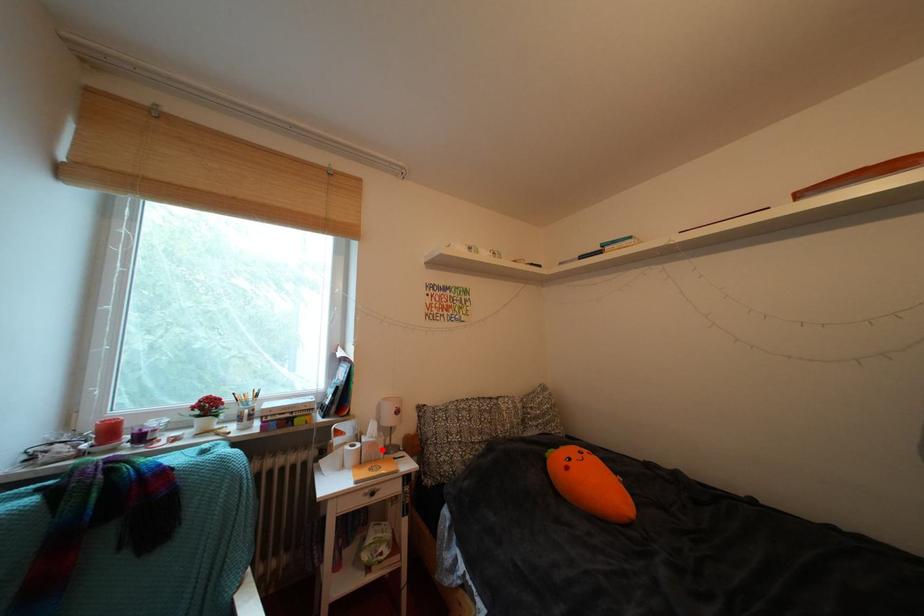
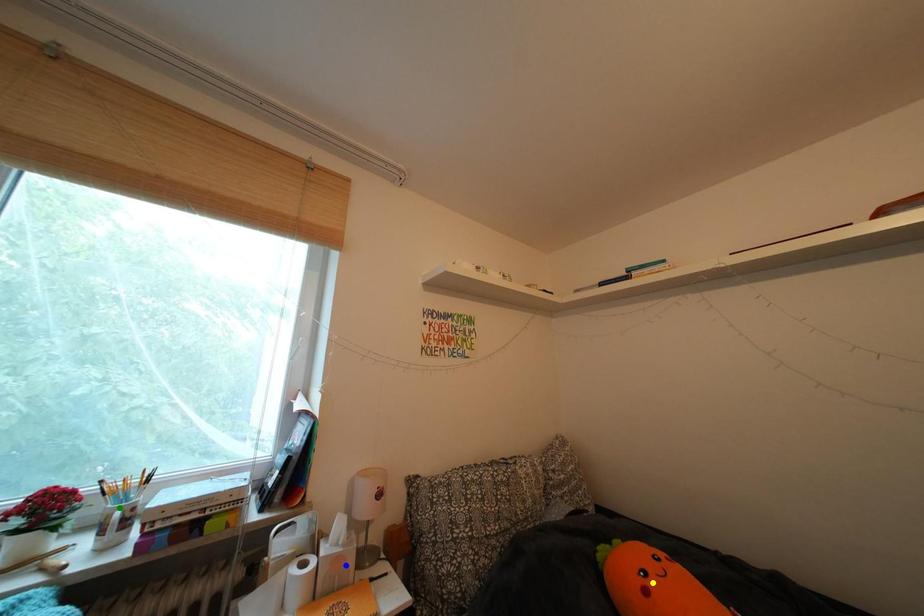
Question: I am providing you with two images of the same scene from different viewpoints. A red point is marked on the first image. You are given multiple points on the second image. Which point in image 2 is actually the same real-world point as the red point in image 1?

Choices:
 (A) yellow point
 (B) green point
 (C) blue point

Answer: (C)